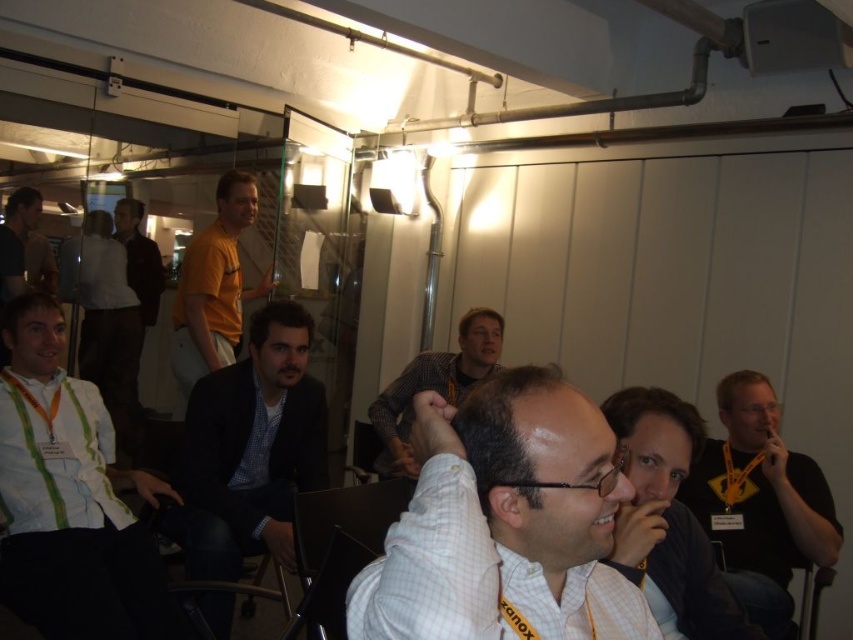
You are standing in the room and want to move from the point at coordinates (645, 554) to the point at coordinates (136, 280). Which direction should you move to get closer to the second point?

To move from the point at coordinates (645, 554) to the point at coordinates (136, 280), you should move downward and to the left because the second point is located lower and to the left of the first point.